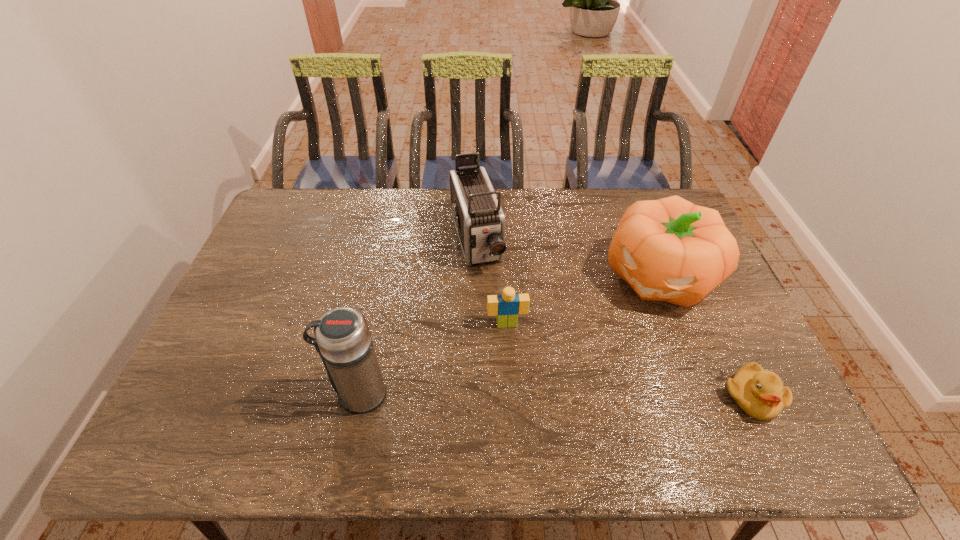
The width and height of the screenshot is (960, 540). Identify the location of the leftmost object. (342, 338).

Find the location of `duckling`. duckling is located at coordinates pos(760,394).

Find the location of a particular element. This screenshot has height=540, width=960. Lego is located at coordinates (507, 306).

The image size is (960, 540). I want to click on camcorder, so click(x=479, y=219).

Where is `pumpkin`? The height and width of the screenshot is (540, 960). pumpkin is located at coordinates (671, 250).

This screenshot has height=540, width=960. I want to click on blank space located with a handle on the side of the thermos bottle, so click(x=252, y=394).

The image size is (960, 540). I want to click on free space located with a handle on the side of the thermos bottle, so click(x=289, y=394).

What are the coordinates of `free space located 0.230m with a handle on the side of the thermos bottle` in the screenshot? It's located at (235, 394).

At what (x,y) coordinates should I click in order to perform the action: click on free space located on the face of the second shortest object. Please return your answer as a coordinate pair (x, y). Looking at the image, I should click on (511, 344).

Find the location of a particular element. free point located 0.110m on the face of the second shortest object is located at coordinates coord(513,363).